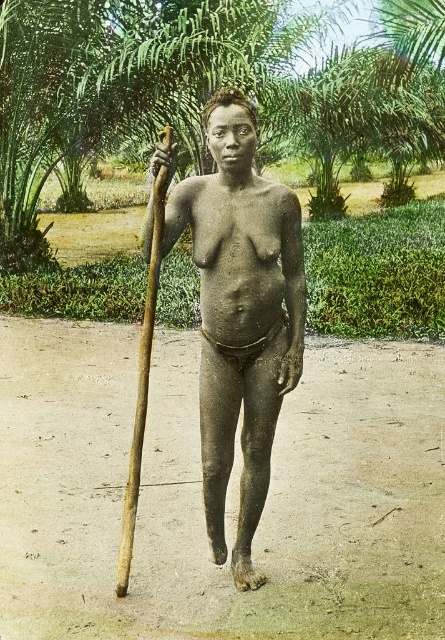
You are a photographer setting up a shot of the person in the scene. You need to place a small prop exactly halfway between point (238, 344) and point (145, 397). Which point should be closer to the camera to ensure the prop is correctly positioned?

Point (238, 344) is further to the camera than point (145, 397). To place the prop halfway between them, the prop should be closer to point (145, 397) since it is nearer to the camera, ensuring the midpoint accounts for their depth positions.

You are an explorer in a tropical forest and need to choose between the brown wooden stick at center and the brown wooden spear at left to use as a walking aid. Which one is positioned closer to your right side?

The brown wooden stick at center is to the right of brown wooden spear at left, so the stick is closer to your right side.